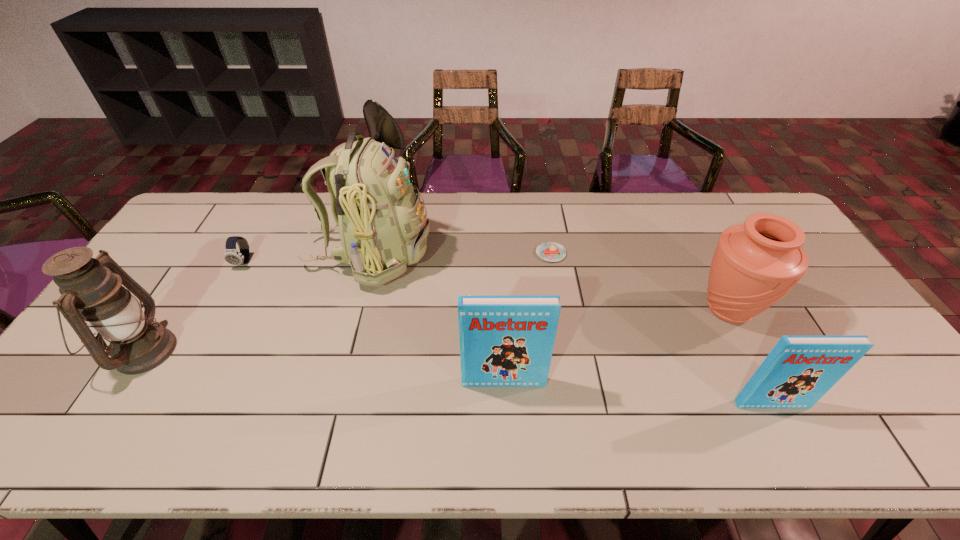
Find the location of a particular element. The height and width of the screenshot is (540, 960). object situated at the near left corner is located at coordinates (91, 293).

Locate an element on the screen. This screenshot has width=960, height=540. free space at the far edge of the desktop is located at coordinates (697, 214).

In the image, there is a desktop. In order to click on vacant space at the left edge in this screenshot , I will do `click(147, 273)`.

Locate an element on the screen. This screenshot has width=960, height=540. vacant space at the far left corner of the desktop is located at coordinates (220, 216).

Where is `free space at the near right corner of the desktop`? free space at the near right corner of the desktop is located at coordinates (921, 407).

Where is `empty space between the third shortest object and the backpack`? The width and height of the screenshot is (960, 540). empty space between the third shortest object and the backpack is located at coordinates (570, 329).

You are a GUI agent. You are given a task and a screenshot of the screen. Output one action in this format:
    pyautogui.click(x=<x>, y=<y>)
    Task: Click on the vacant space that's between the leftmost object and the watch
    The image size is (960, 540).
    Given the screenshot: What is the action you would take?
    pyautogui.click(x=194, y=307)

Where is `blank region between the left book and the sixth object from right to left`? blank region between the left book and the sixth object from right to left is located at coordinates (373, 322).

The height and width of the screenshot is (540, 960). In order to click on vacant space that's between the shortest object and the nearest object in this screenshot , I will do `click(661, 329)`.

Locate an element on the screen. Image resolution: width=960 pixels, height=540 pixels. free space between the fourth object from left to right and the leftmost object is located at coordinates (324, 367).